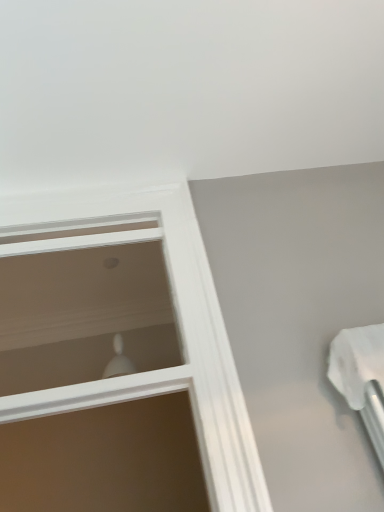
You are a GUI agent. You are given a task and a screenshot of the screen. Output one action in this format:
    pyautogui.click(x=<x>, y=<y>)
    Task: Click on the white plastic towel bar at upper right
    
    Given the screenshot: What is the action you would take?
    pyautogui.click(x=361, y=377)

The height and width of the screenshot is (512, 384). What do you see at coordinates (361, 377) in the screenshot?
I see `white plastic towel bar at upper right` at bounding box center [361, 377].

You are a GUI agent. You are given a task and a screenshot of the screen. Output one action in this format:
    pyautogui.click(x=<x>, y=<y>)
    Task: Click on the white plastic towel bar at upper right
    The width and height of the screenshot is (384, 512).
    Given the screenshot: What is the action you would take?
    pyautogui.click(x=361, y=377)